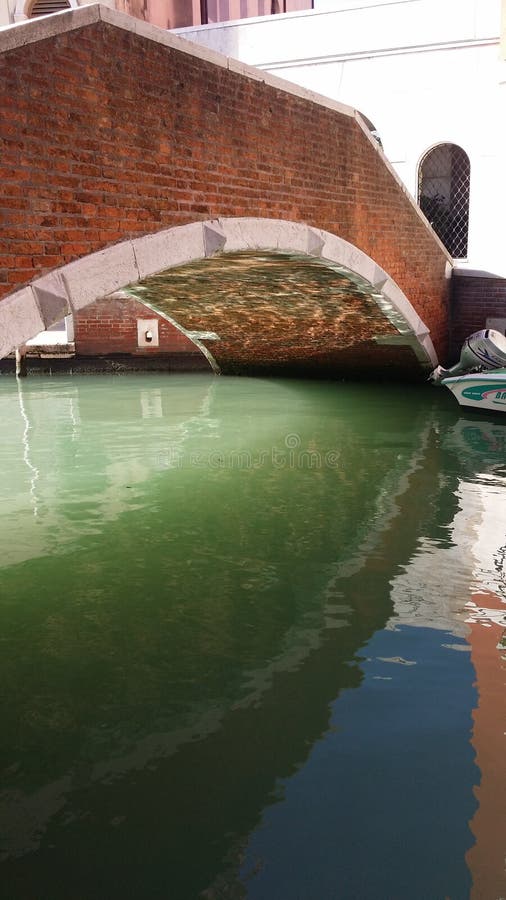
Find the location of `wall`. wall is located at coordinates 427,75.